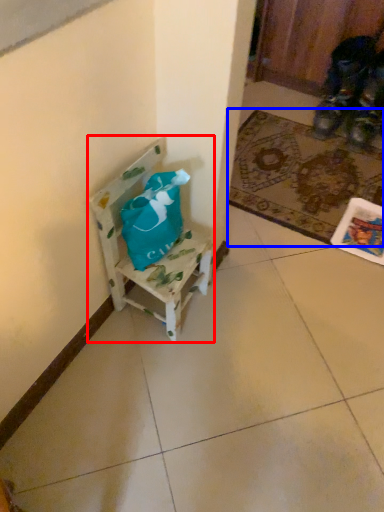
Question: Which point is closer to the camera, chair (highlighted by a red box) or mat (highlighted by a blue box)?

Choices:
 (A) chair
 (B) mat

Answer: (A)